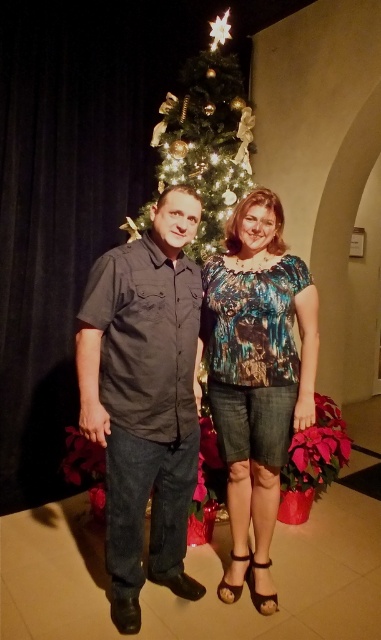
Is point (152, 509) closer to viewer compared to point (251, 260)?

Yes, point (152, 509) is closer to viewer.

Between matte black shirt at center and printed fabric blouse at center, which one is positioned lower?

matte black shirt at center

Image resolution: width=381 pixels, height=640 pixels. What do you see at coordinates (144, 397) in the screenshot?
I see `matte black shirt at center` at bounding box center [144, 397].

Identify the location of matte black shirt at center. tap(144, 397).

Is matte black shirt at center further to the viewer compared to green glittering christmas tree at center?

No.

What do you see at coordinates (144, 397) in the screenshot? Image resolution: width=381 pixels, height=640 pixels. I see `matte black shirt at center` at bounding box center [144, 397].

The image size is (381, 640). Identify the location of matte black shirt at center. (144, 397).

Can you confirm if printed fabric blouse at center is thinner than green glittering christmas tree at center?

Yes.

Between printed fabric blouse at center and green glittering christmas tree at center, which one is positioned lower?

printed fabric blouse at center is below.

Which is behind, point (251, 330) or point (222, 52)?

The point (222, 52) is behind.

You are a GUI agent. You are given a task and a screenshot of the screen. Output one action in this format:
    pyautogui.click(x=<x>, y=<y>)
    Task: Click on the printed fabric blouse at center
    The image size is (381, 640).
    Given the screenshot: What is the action you would take?
    pyautogui.click(x=256, y=376)